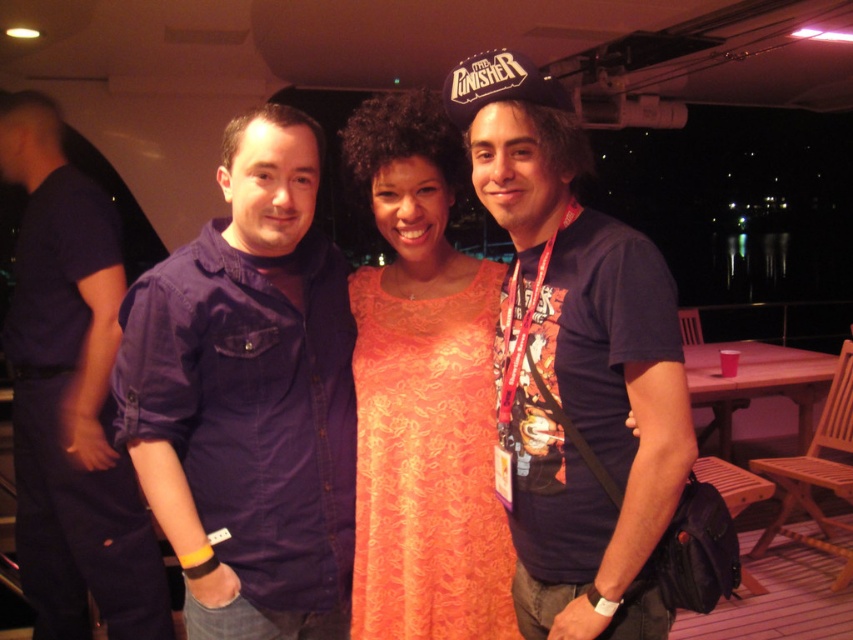
Question: Is red lanyard at center closer to camera compared to denim shirt at left?

Choices:
 (A) yes
 (B) no

Answer: (A)

Question: Which object is closer to the camera taking this photo?

Choices:
 (A) orange lace dress at center
 (B) red lanyard at center
 (C) denim shirt at center

Answer: (B)

Question: Is red lanyard at center further to the viewer compared to orange lace dress at center?

Choices:
 (A) no
 (B) yes

Answer: (A)

Question: Among these points, which one is nearest to the camera?

Choices:
 (A) coord(416,618)
 (B) coord(331,314)
 (C) coord(640,314)
 (D) coord(154,604)

Answer: (C)

Question: Which point is closer to the camera?

Choices:
 (A) denim shirt at left
 (B) red lanyard at center
 (C) orange lace dress at center
 (D) denim shirt at center

Answer: (B)

Question: Can you confirm if orange lace dress at center is bigger than denim shirt at left?

Choices:
 (A) yes
 (B) no

Answer: (B)